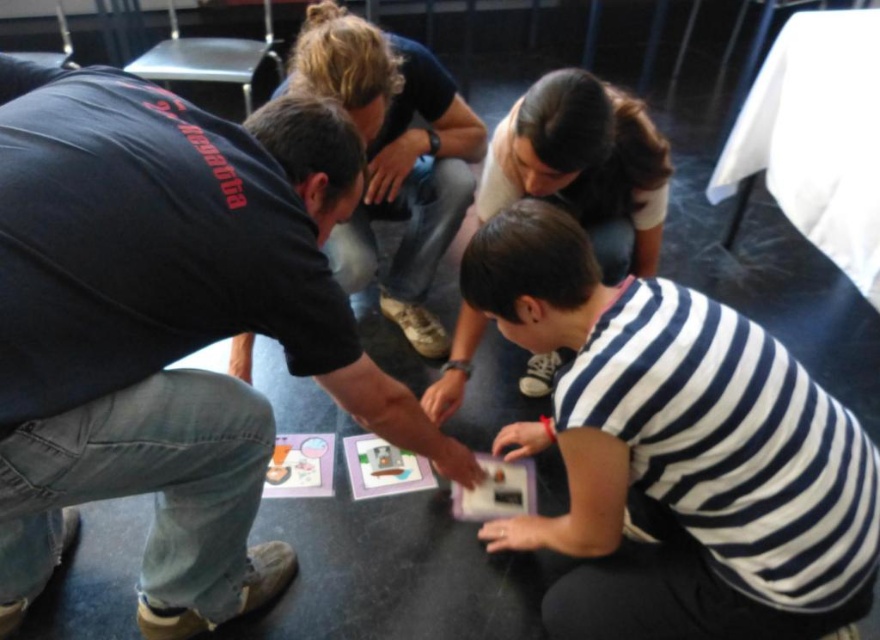
Based on the scene description, where is the white striped shirt at lower center located in terms of its 2D coordinates?

The white striped shirt at lower center is located at the 2D coordinates of point (675, 452).

You are trying to place a 10 cm wide decorative item on the floor between the white striped shirt at lower center and the white matte card at lower center. Can the space accommodate it?

The white striped shirt at lower center might be wider than the white matte card at lower center, so the space between them may not be sufficient to fit a 10 cm wide decorative item.